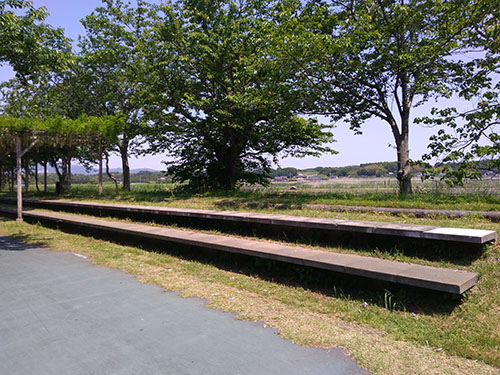
Locate an element on the screen. The width and height of the screenshot is (500, 375). place to sit is located at coordinates (254, 239), (306, 225).